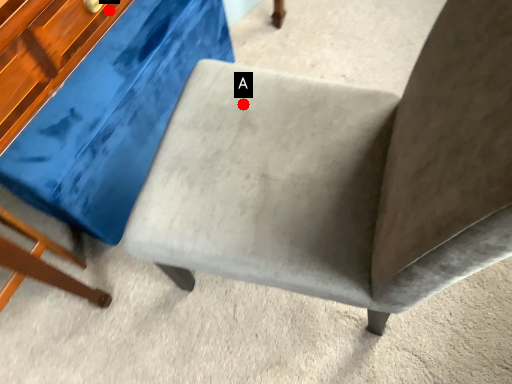
Question: Two points are circled on the image, labeled by A and B beside each circle. Among these points, which one is farthest from the camera?

Choices:
 (A) A is further
 (B) B is further

Answer: (A)